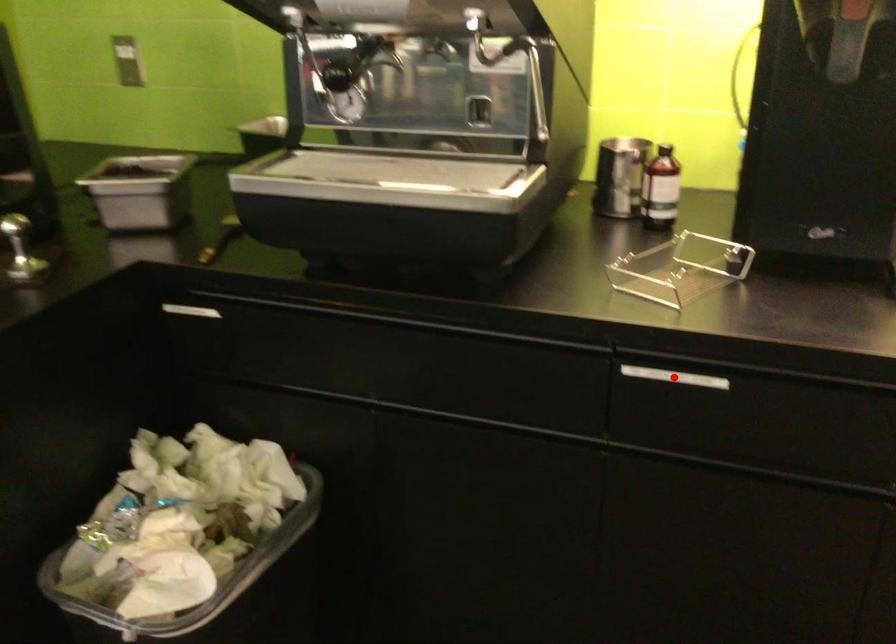
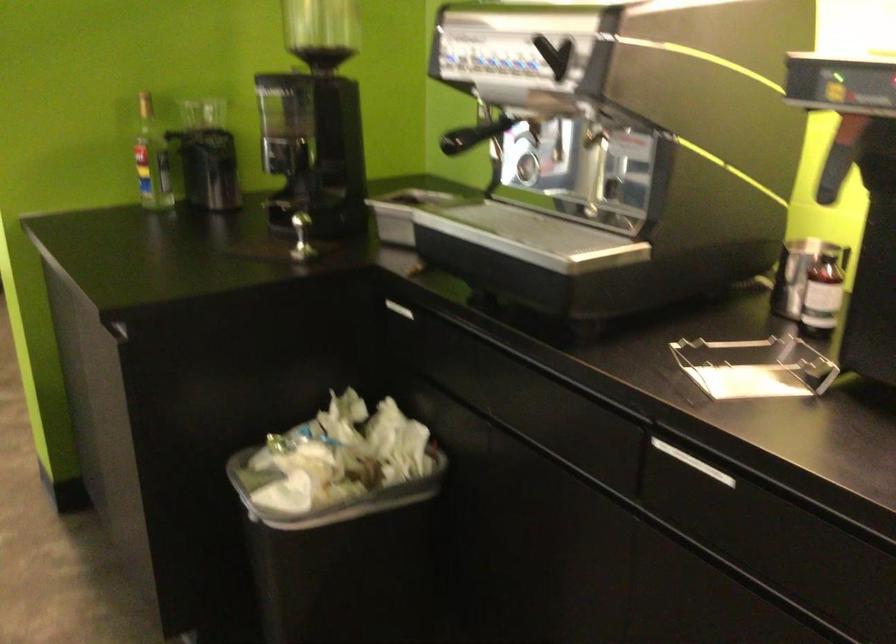
Find the pixel in the second image that matches the highlighted location in the first image.

(693, 462)